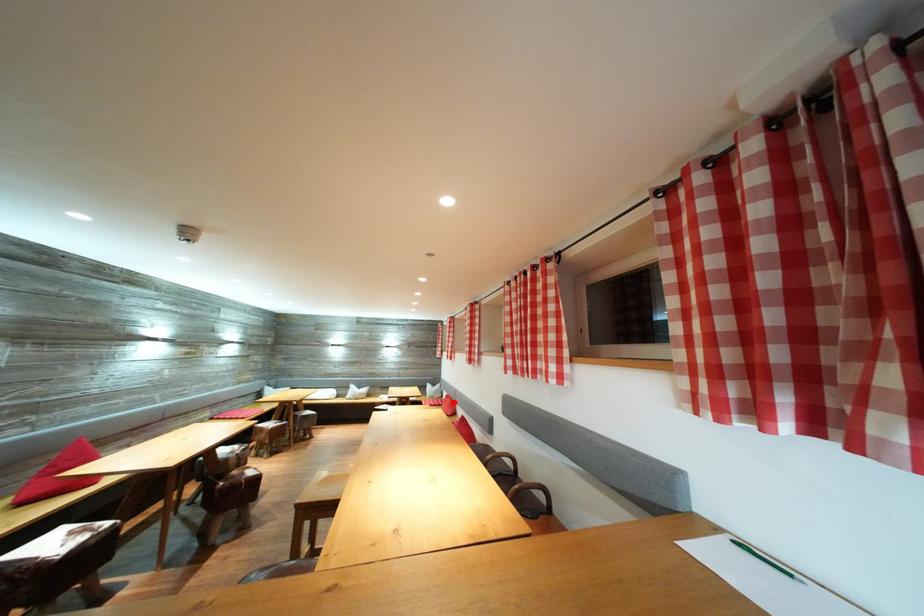
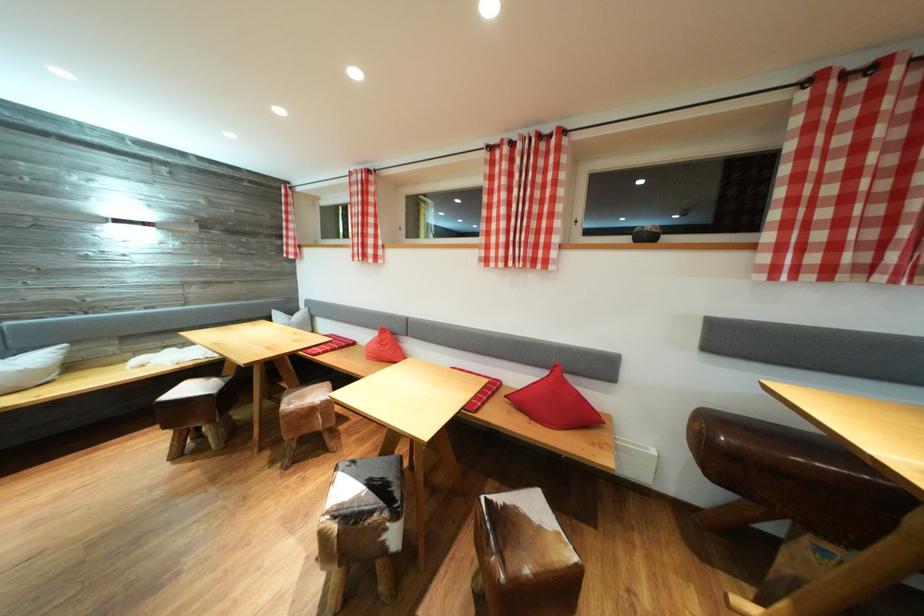
Question: A red point is marked in image1. In image2, is the corresponding 3D point closer to the camera or farther? Reply with the corresponding letter.

Choices:
 (A) The corresponding 3D point is closer.
 (B) The corresponding 3D point is farther.

Answer: (A)